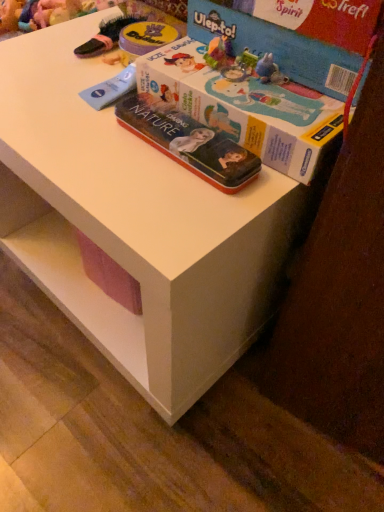
This screenshot has width=384, height=512. Identify the location of vacant space situated above blue cardboard box at upper right, which is counted as the 2th box, starting from the top (from a real-world perspective). (263, 70).